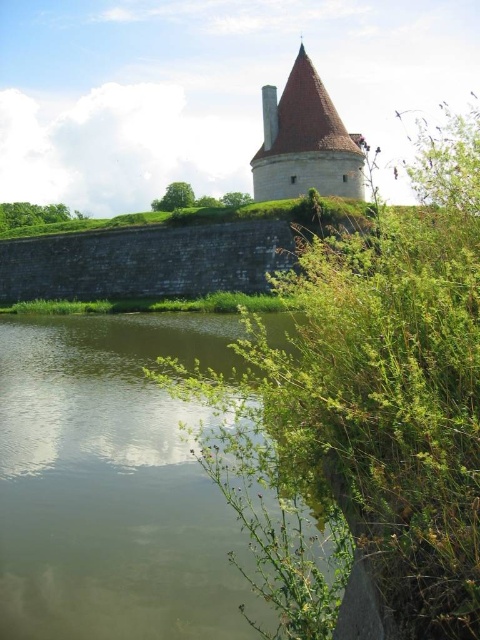
Question: Is green grassy river at lower left to the right of smooth beige stone tower at upper center from the viewer's perspective?

Choices:
 (A) yes
 (B) no

Answer: (B)

Question: In this image, where is green grassy river at lower left located relative to smooth beige stone tower at upper center?

Choices:
 (A) right
 (B) left

Answer: (B)

Question: Does green grassy river at lower left appear on the left side of smooth beige stone tower at upper center?

Choices:
 (A) yes
 (B) no

Answer: (A)